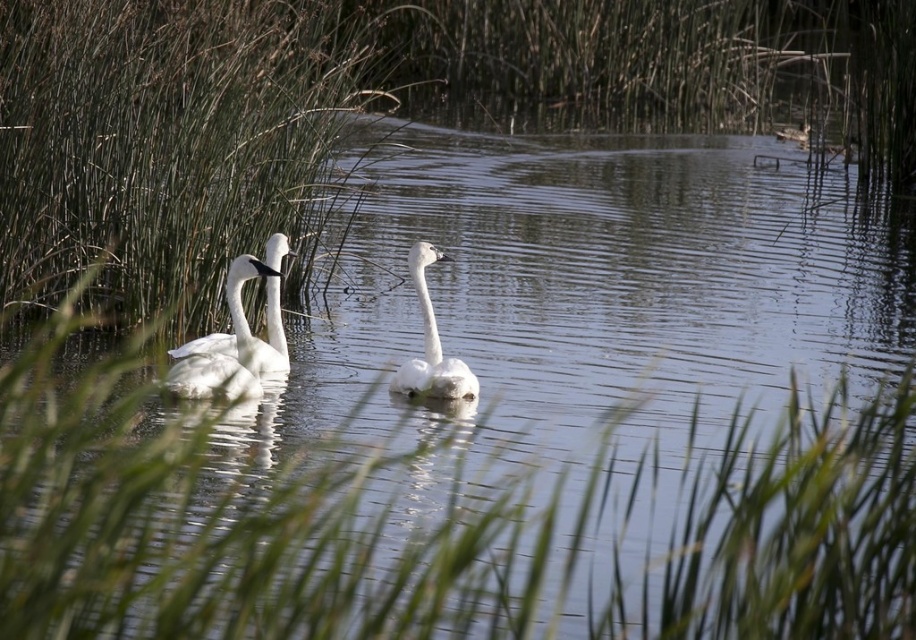
You are a photographer aiming to capture a clear shot of the white glossy swan at left without any obstructions. Given that the green grass at upper left is in the foreground, will the swan be visible behind it?

The white glossy swan at left is behind the green grass at upper left, so it may be partially obscured depending on the grass density and camera angle. However, since the grass appears slightly blurred in the scene, the swan should still be visible through the green grass at upper left.

You are observing the swans in the serene pond. Which swan, the white glossy swan at left or the white matte swan at center, is positioned closer to the left side of the pond?

The white glossy swan at left is positioned closer to the left side of the pond as it is to the left of the white matte swan at center.